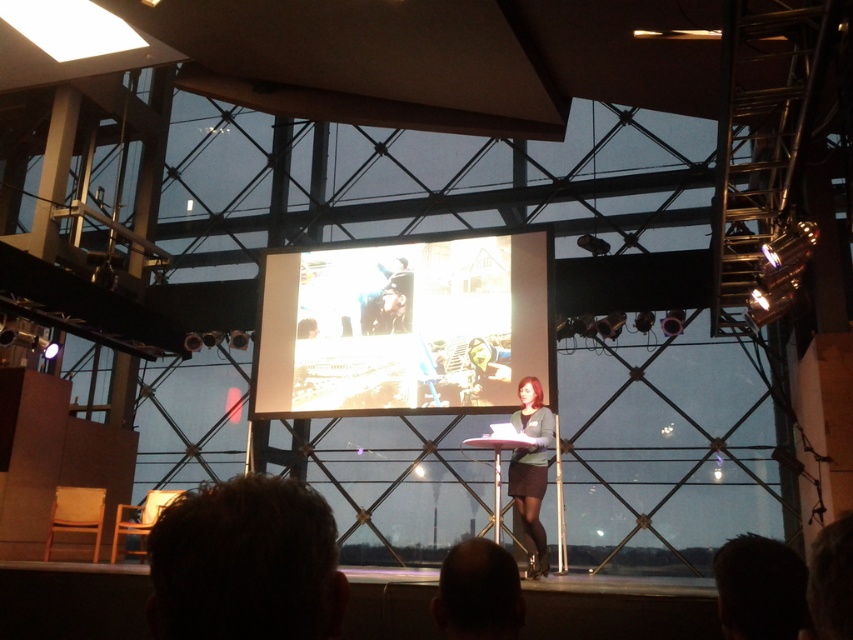
You are standing at the camera position and want to walk directly to the point marked at coordinates (358, 317). How far will you have to walk?

The point marked at coordinates (358, 317) is 7.92 meters away from the camera, so you will have to walk 7.92 meters to reach it.

Consider the image. You are an attendee at the presentation and want to describe the speaker. Which object is located above the other between the dark brown hair at lower center and the matte gray sweater at center?

The dark brown hair at lower center is positioned over the matte gray sweater at center.